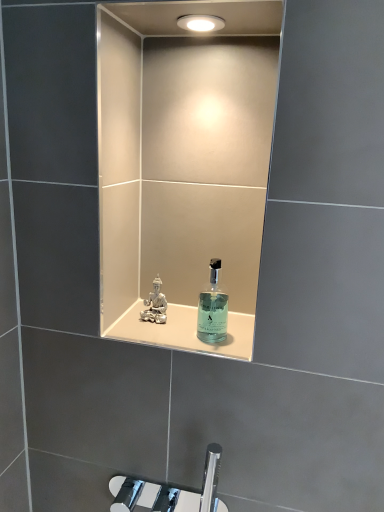
Question: Can you confirm if transparent glass bottle at center is thinner than clear glass perfume at center?

Choices:
 (A) no
 (B) yes

Answer: (A)

Question: Considering the relative positions of transparent glass bottle at center and clear glass perfume at center in the image provided, is transparent glass bottle at center behind clear glass perfume at center?

Choices:
 (A) no
 (B) yes

Answer: (A)

Question: From a real-world perspective, is transparent glass bottle at center on top of clear glass perfume at center?

Choices:
 (A) no
 (B) yes

Answer: (B)

Question: Does transparent glass bottle at center have a greater width compared to clear glass perfume at center?

Choices:
 (A) yes
 (B) no

Answer: (A)

Question: Can you confirm if transparent glass bottle at center is taller than clear glass perfume at center?

Choices:
 (A) no
 (B) yes

Answer: (B)

Question: Is transparent glass bottle at center outside clear glass perfume at center?

Choices:
 (A) yes
 (B) no

Answer: (A)

Question: From the image's perspective, does clear glass perfume at center appear lower than transparent glass bottle at center?

Choices:
 (A) yes
 (B) no

Answer: (B)

Question: Are clear glass perfume at center and transparent glass bottle at center making contact?

Choices:
 (A) no
 (B) yes

Answer: (A)

Question: Does clear glass perfume at center have a smaller size compared to transparent glass bottle at center?

Choices:
 (A) yes
 (B) no

Answer: (A)

Question: Can you confirm if clear glass perfume at center is bigger than transparent glass bottle at center?

Choices:
 (A) yes
 (B) no

Answer: (B)

Question: Is clear glass perfume at center turned away from transparent glass bottle at center?

Choices:
 (A) no
 (B) yes

Answer: (A)

Question: Is clear glass perfume at center oriented towards transparent glass bottle at center?

Choices:
 (A) no
 (B) yes

Answer: (A)

Question: From a real-world perspective, is translucent glass bottle at center positioned under transparent glass bottle at center based on gravity?

Choices:
 (A) no
 (B) yes

Answer: (B)